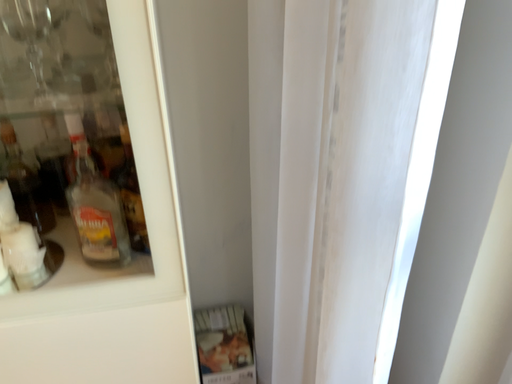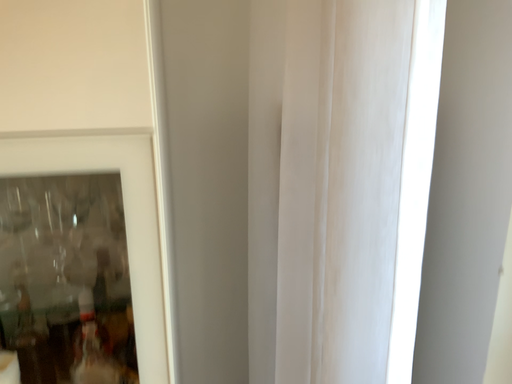
Question: How did the camera likely rotate when shooting the video?

Choices:
 (A) rotated upward
 (B) rotated downward

Answer: (A)